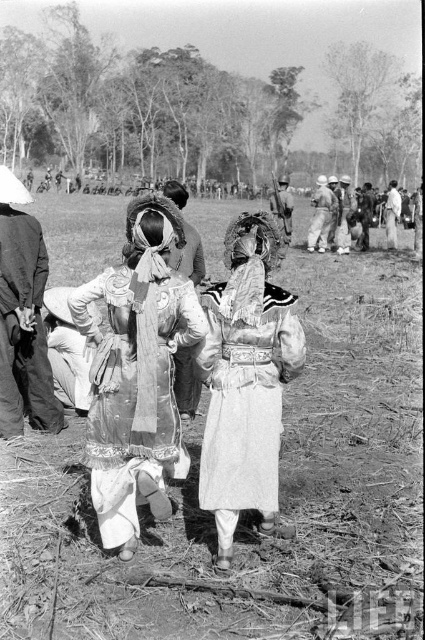
You are a photographer trying to capture the dirt field at center and the white textured dress at center in a single frame. Based on their relative heights, which object will appear larger in the photo?

The dirt field at center is much taller than the white textured dress at center, so it will appear larger in the photo.